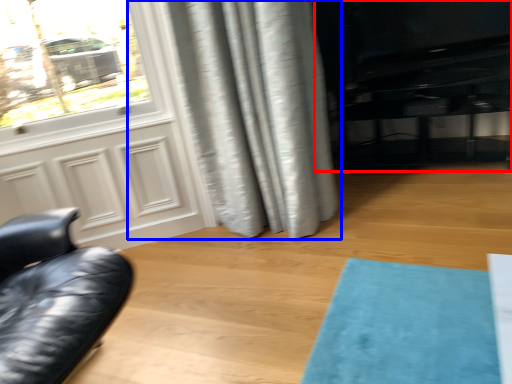
Question: Which object is further to the camera taking this photo, entertainment center (highlighted by a red box) or curtain (highlighted by a blue box)?

Choices:
 (A) entertainment center
 (B) curtain

Answer: (A)